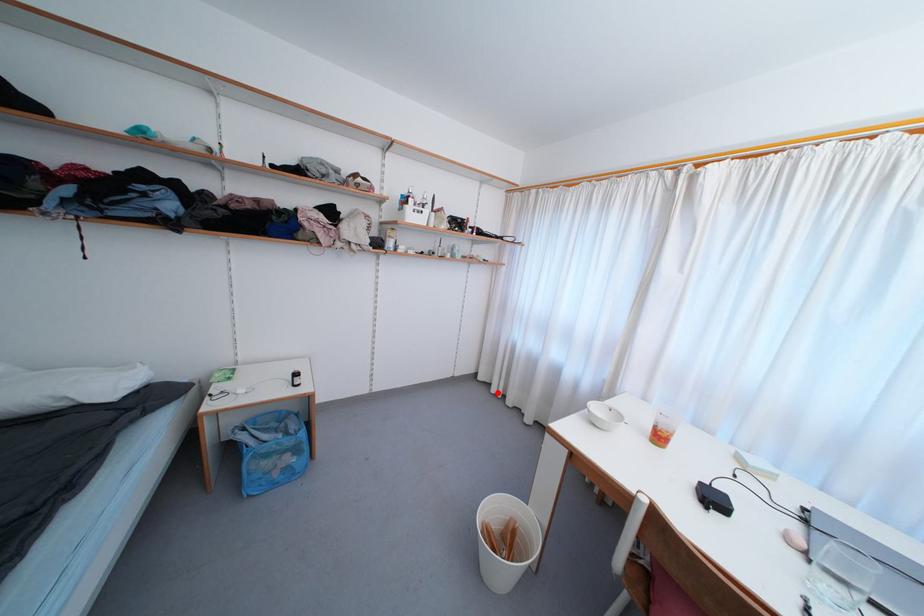
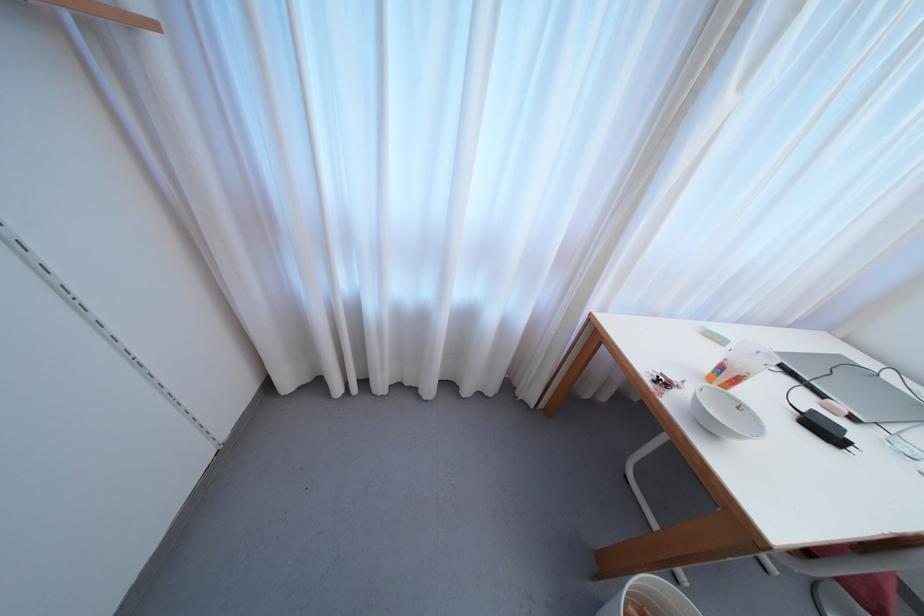
Question: A red point is marked in image1. In image2, is the corresponding 3D point closer to the camera or farther? Reply with the corresponding letter.

Choices:
 (A) The corresponding 3D point is closer.
 (B) The corresponding 3D point is farther.

Answer: (B)